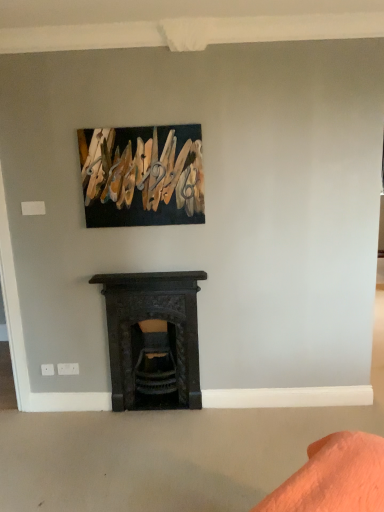
Find the location of a particular element. Image resolution: width=384 pixels, height=512 pixels. vacant space underneath wooden clothespins at upper center (from a real-world perspective) is located at coordinates (148, 268).